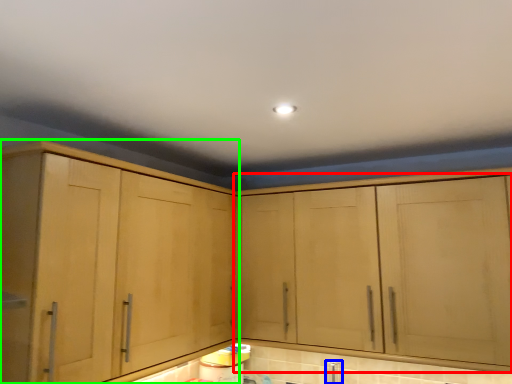
Question: Which is farther away from cabinetry (highlighted by a red box)? faucet (highlighted by a blue box) or cabinetry (highlighted by a green box)?

Choices:
 (A) faucet
 (B) cabinetry

Answer: (B)